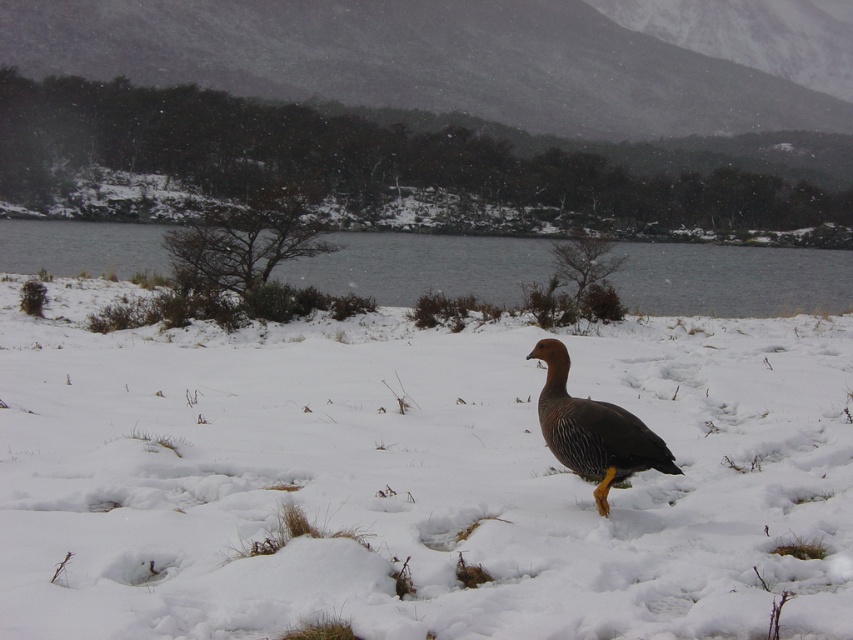
You are a photographer aiming to capture the brown feathered duck at center and the gray water at center in the same frame. Based on their positions, which object should you adjust your camera focus to first if you want to ensure both are in focus?

The gray water at center is positioned on the left side of brown feathered duck at center. Since the gray water is closer to the camera, you should focus on it first to ensure both are in focus.

You are standing in the winter landscape and want to place a small flag at the closest point between the two points, point [787,605] and point [553,428]. Which point should you choose?

Point [787,605] is closer to the camera than point [553,428], so you should place the flag at point [787,605].

You are a bird with a wingspan of 1 meter. You want to fly from the white fluffy snow at center to the gray water at center. Can you do it without flapping your wings?

The white fluffy snow at center has a lesser width compared to gray water at center. Since the snow is narrower, the distance between them is too short for the bird to glide without flapping its wings. Therefore, it cannot make the flight without flapping.